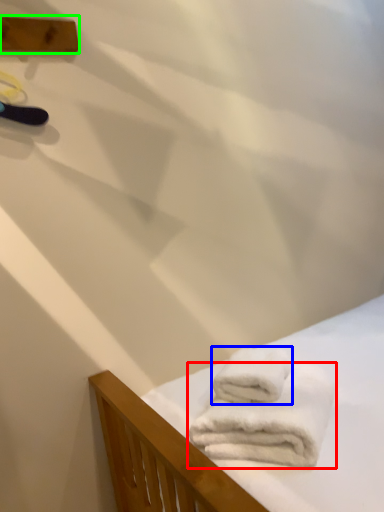
Question: Which object is positioned farthest from towel (highlighted by a red box)? Select from towel (highlighted by a blue box) and plank (highlighted by a green box).

Choices:
 (A) towel
 (B) plank

Answer: (B)